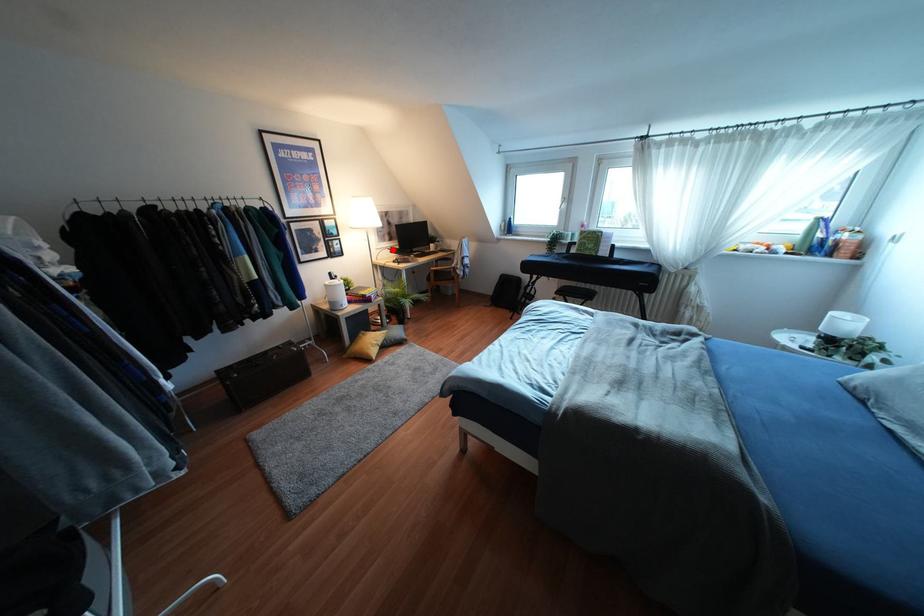
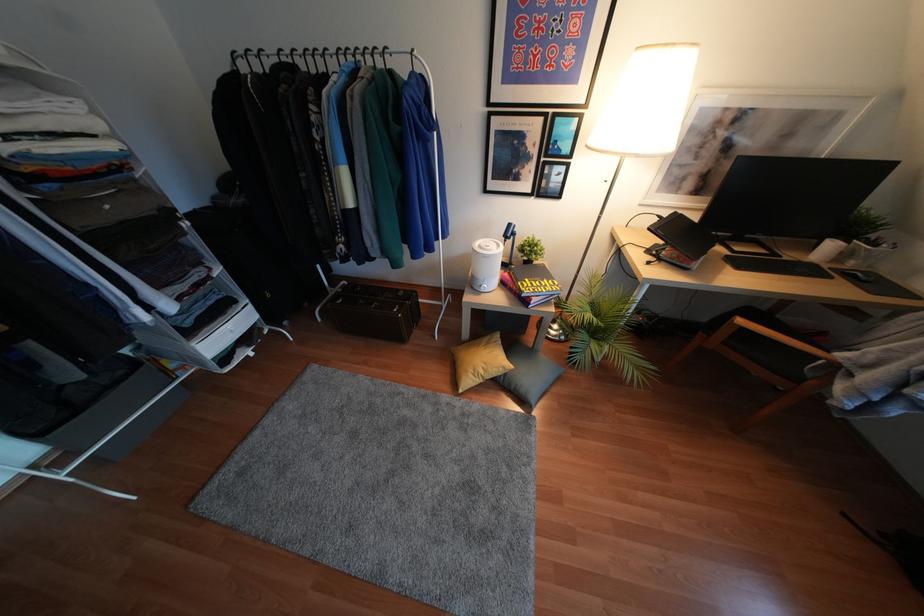
The point at the highlighted location is marked in the first image. Where is the corresponding point in the second image?

(666, 224)